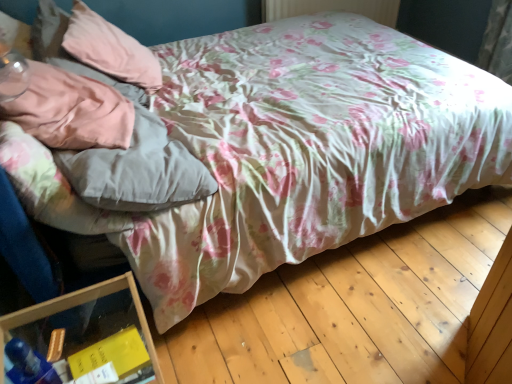
Question: Considering the positions of point (141, 79) and point (28, 322), is point (141, 79) closer or farther from the camera than point (28, 322)?

Choices:
 (A) farther
 (B) closer

Answer: (A)

Question: From a real-world perspective, relative to transparent plastic container at lower left, is pink fabric pillow at upper left, marked as the second pillow in a front-to-back arrangement, vertically above or below?

Choices:
 (A) above
 (B) below

Answer: (A)

Question: Based on their relative distances, which object is nearer to the pink fabric pillow at upper left, marked as the second pillow in a front-to-back arrangement?

Choices:
 (A) satin pink pillow at upper left, which is the first pillow from front to back
 (B) transparent plastic container at lower left

Answer: (A)

Question: Which object is the closest to the pink fabric pillow at upper left, the 1th pillow from the back?

Choices:
 (A) satin pink pillow at upper left, which is the second pillow in back-to-front order
 (B) transparent plastic container at lower left

Answer: (A)